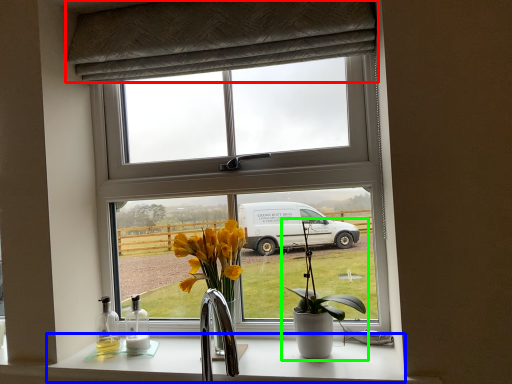
Question: Considering the real-world distances, which object is closest to curtain (highlighted by a red box)? counter top (highlighted by a blue box) or houseplant (highlighted by a green box).

Choices:
 (A) counter top
 (B) houseplant

Answer: (B)